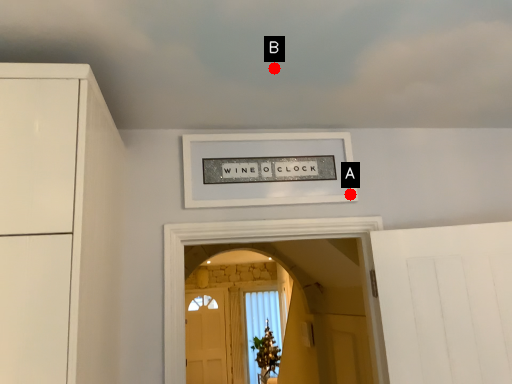
Question: Two points are circled on the image, labeled by A and B beside each circle. Which of the following is the farthest from the observer?

Choices:
 (A) A is further
 (B) B is further

Answer: (A)